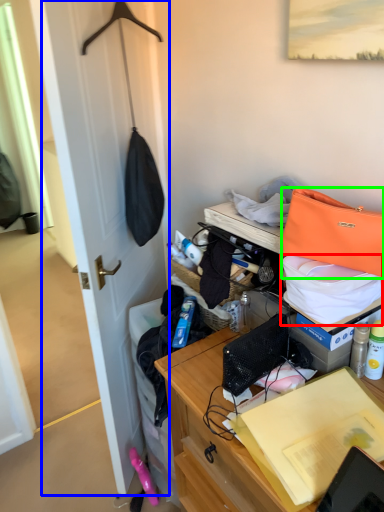
Question: Which is nearer to the kit (highlighted by a red box)? door (highlighted by a blue box) or handbag (highlighted by a green box).

Choices:
 (A) door
 (B) handbag

Answer: (B)